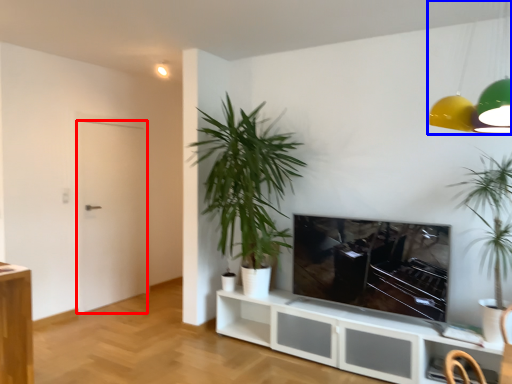
Question: Which of the following is the closest to the observer, door (highlighted by a red box) or lamp (highlighted by a blue box)?

Choices:
 (A) door
 (B) lamp

Answer: (B)